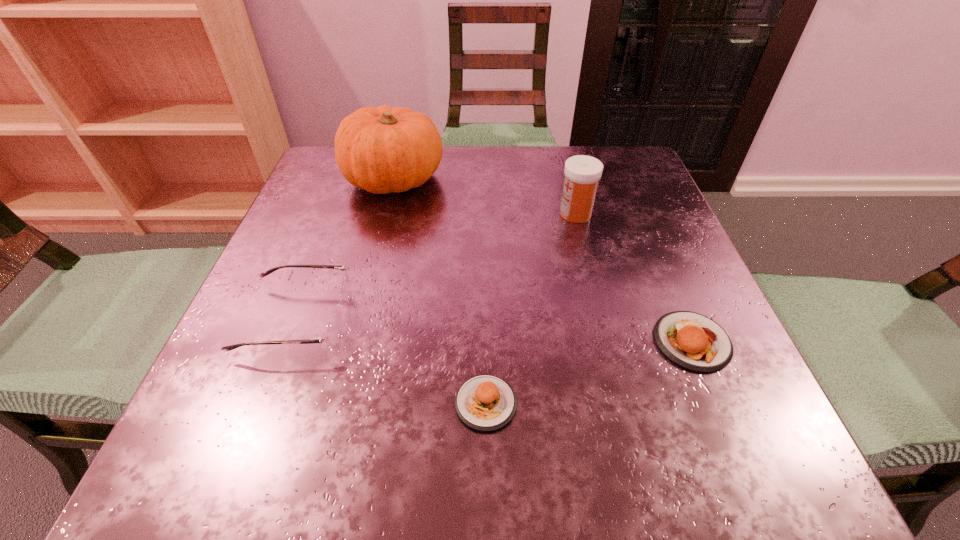
Where is `vacant area situated on the front-facing side of the spectacles`? This screenshot has height=540, width=960. vacant area situated on the front-facing side of the spectacles is located at coordinates (483, 320).

Where is `vacant space situated on the back of the rightmost object`? vacant space situated on the back of the rightmost object is located at coordinates coord(626,184).

Locate an element on the screen. free space located 0.340m on the left of the third object from left to right is located at coordinates (201, 403).

Locate an element on the screen. The height and width of the screenshot is (540, 960). pumpkin located in the far edge section of the desktop is located at coordinates (381, 150).

Find the location of a particular element. Image resolution: width=960 pixels, height=540 pixels. medicine positioned at the far edge is located at coordinates (582, 173).

Identify the location of object present at the near edge. This screenshot has height=540, width=960. point(485,402).

Where is `pumpkin that is at the left edge`? pumpkin that is at the left edge is located at coordinates (381, 150).

Identify the location of spectacles that is positioned at the left edge. (332, 335).

In order to click on medicine present at the right edge in this screenshot , I will do `click(582, 173)`.

Locate an element on the screen. This screenshot has width=960, height=540. patty (food) that is positioned at the right edge is located at coordinates (693, 341).